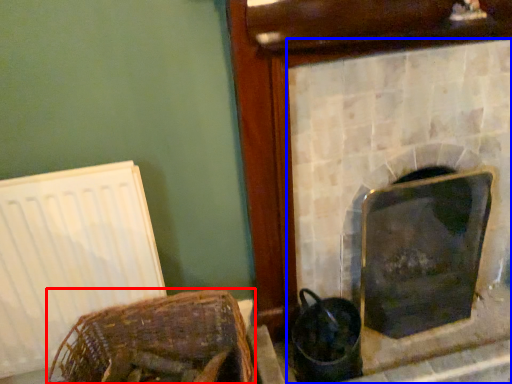
Question: Among these objects, which one is farthest to the camera, basket (highlighted by a red box) or fireplace (highlighted by a blue box)?

Choices:
 (A) basket
 (B) fireplace

Answer: (B)